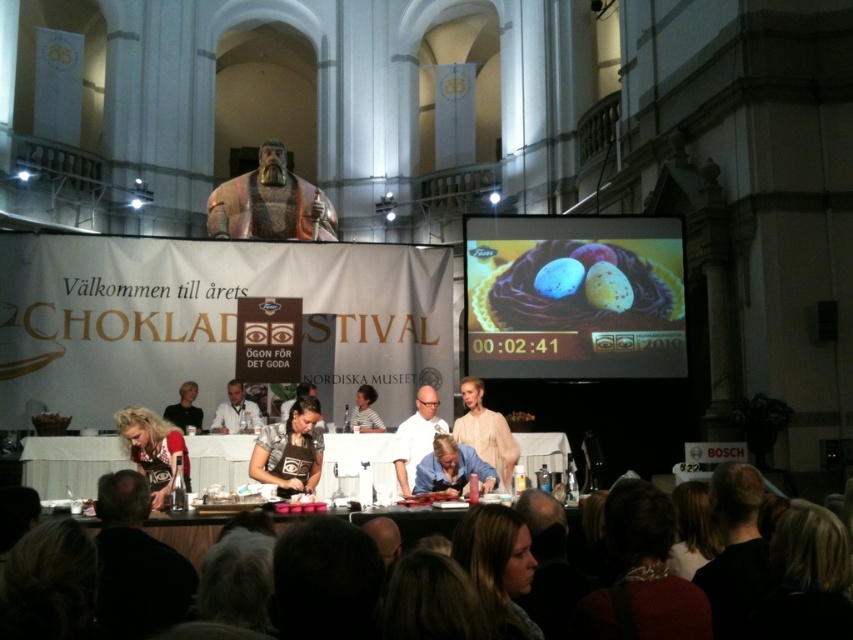
What is located at the point with coordinates (270, 204) in the image?

The point with coordinates (270, 204) is on the gold textured statue at upper center.

Based on the photo, you are standing at the entrance of the grand hall and want to walk towards the stage. There are two points marked in the image. The first point is at coordinates point (x=323, y=211) and the second point is at point (x=167, y=497). Which point is closer to the stage?

Point (x=167, y=497) is closer to the stage because it is in front of point (x=323, y=211).

You are standing at the event and want to take a photo of the gold textured statue at upper center. The statue is 176.91 feet away from you. Your camera has a maximum zoom range of 100 feet. Can you capture the statue in full without moving closer?

The gold textured statue at upper center is 176.91 feet away from the viewer. Since the camera can only zoom up to 100 feet, you cannot capture the statue in full without moving closer.